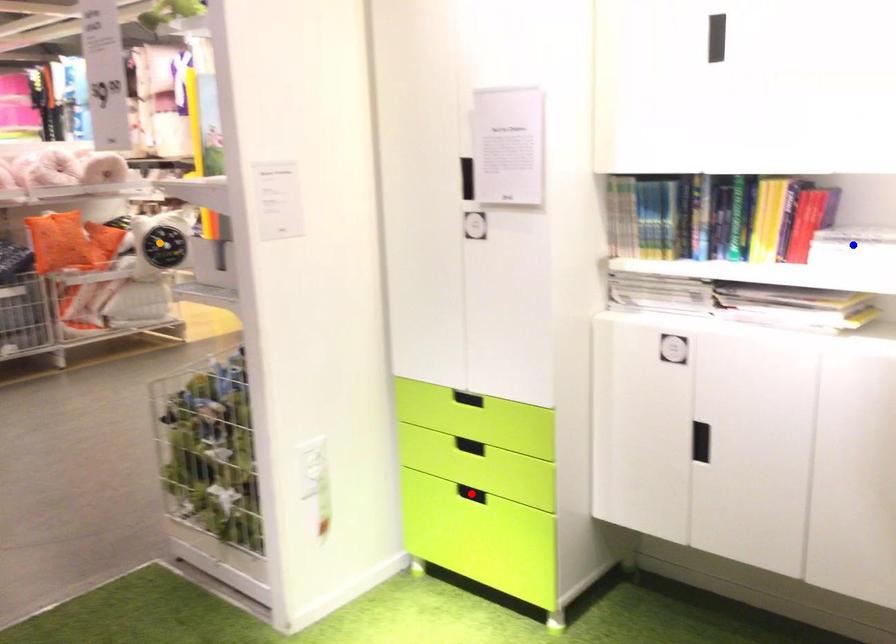
Order these from farthest to nearest:
orange point, red point, blue point

orange point → red point → blue point